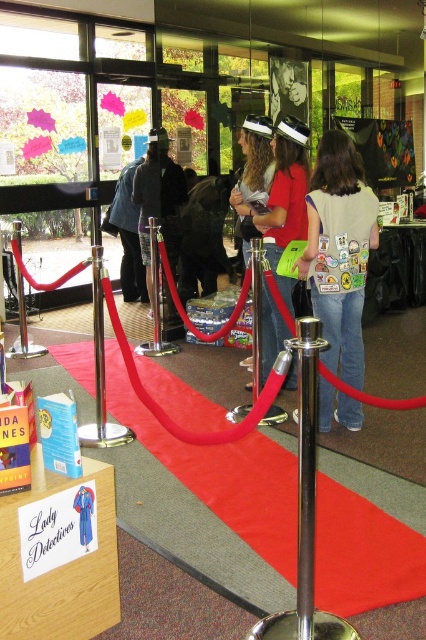
Question: Which point is farther to the camera?

Choices:
 (A) white fabric shirt at center
 (B) metallic silver pole at center

Answer: (A)

Question: Which object is the closest to the red shirt at center?

Choices:
 (A) metallic silver pole at center
 (B) white fabric shirt at center
 (C) dark blue fabric hat at center

Answer: (B)

Question: Based on their relative distances, which object is nearer to the dark blue fabric hat at center?

Choices:
 (A) red shirt at center
 (B) white fabric shirt at center
 (C) metallic silver pole at center

Answer: (A)

Question: Observing the image, what is the correct spatial positioning of white fabric shirt at center in reference to red shirt at center?

Choices:
 (A) below
 (B) above

Answer: (A)

Question: Can you confirm if white fabric shirt at center is bigger than metallic silver pole at center?

Choices:
 (A) no
 (B) yes

Answer: (B)

Question: Is red shirt at center to the left of dark blue fabric hat at center from the viewer's perspective?

Choices:
 (A) yes
 (B) no

Answer: (B)